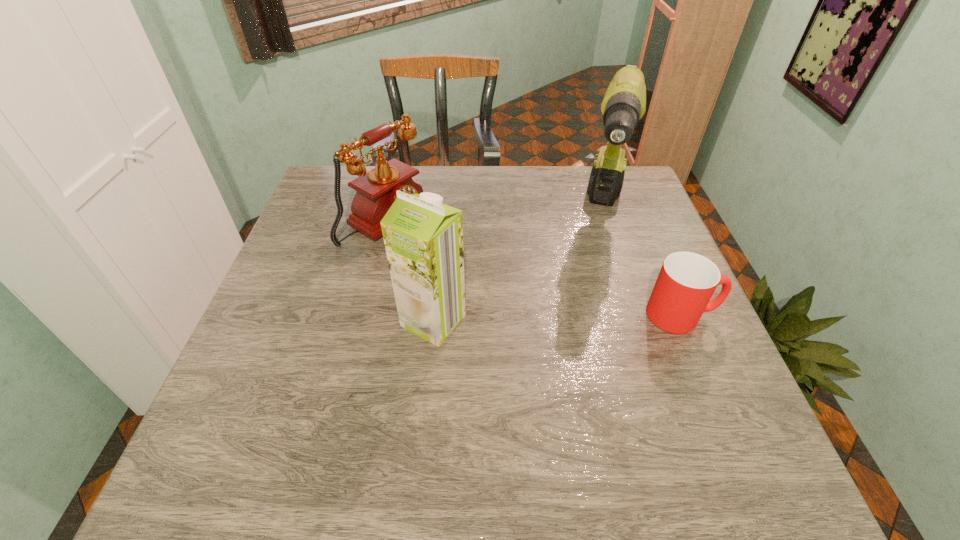
The width and height of the screenshot is (960, 540). What are the coordinates of `vacant space on the desktop that is between the soya milk and the shortest object and is positioned on the handle side of the drill` in the screenshot? It's located at (582, 317).

The image size is (960, 540). In order to click on vacant spot on the desktop that is between the soya milk and the cup and is positioned on the dial of the telephone in this screenshot , I will do `click(560, 318)`.